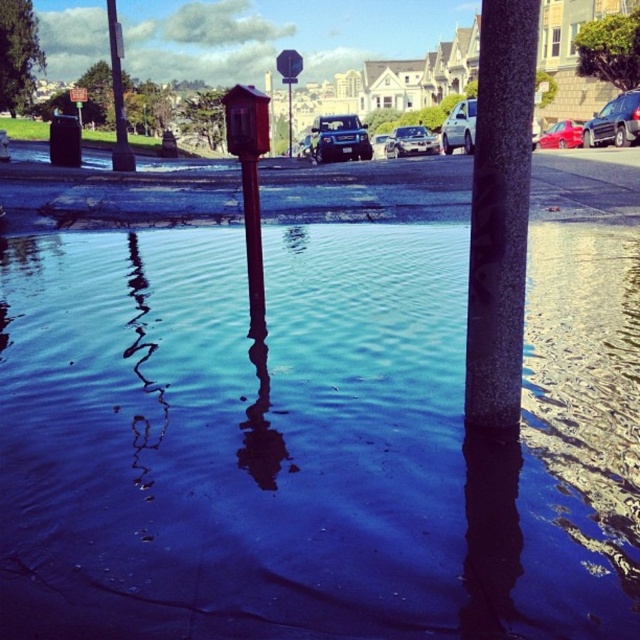
You are a delivery person trying to avoid stepping into the puddles. You see the blue reflective water at center and the brushed metal pole at upper left. Which one is smaller in size?

The blue reflective water at center is smaller than the brushed metal pole at upper left.

You are standing at the point marked as point (460, 128). What vehicle is located at that point?

At point (460, 128) lies a silver metallic sedan at center.

You are a delivery driver needing to park your vehicle in a spot that can accommodate taller vehicles. You see a satin black suv at upper right and a shiny red sedan at center in the parking area. Which vehicle should you choose to park in the same spot as?

The satin black suv at upper right has a greater height compared to the shiny red sedan at center, so you should choose to park in the same spot as the satin black suv at upper right since it can accommodate taller vehicles.